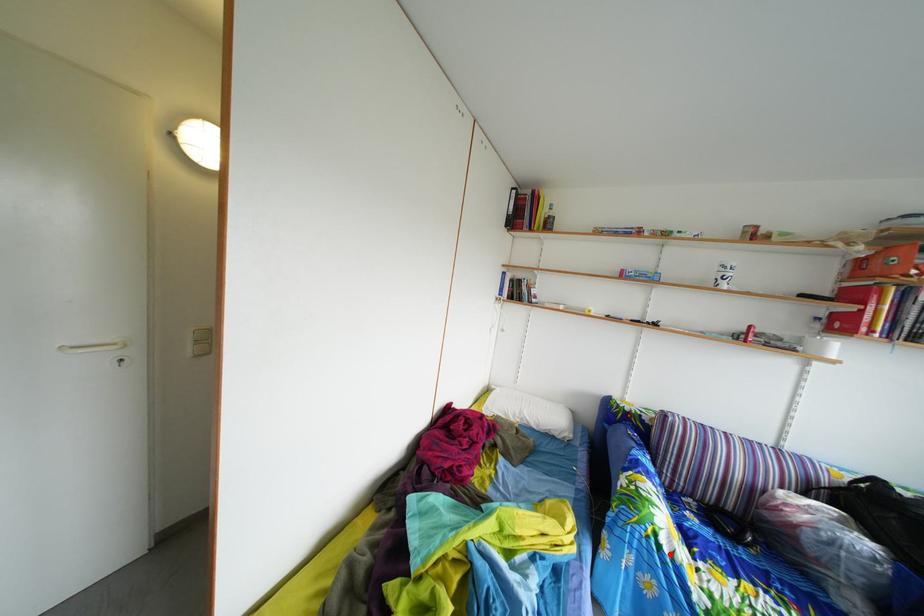
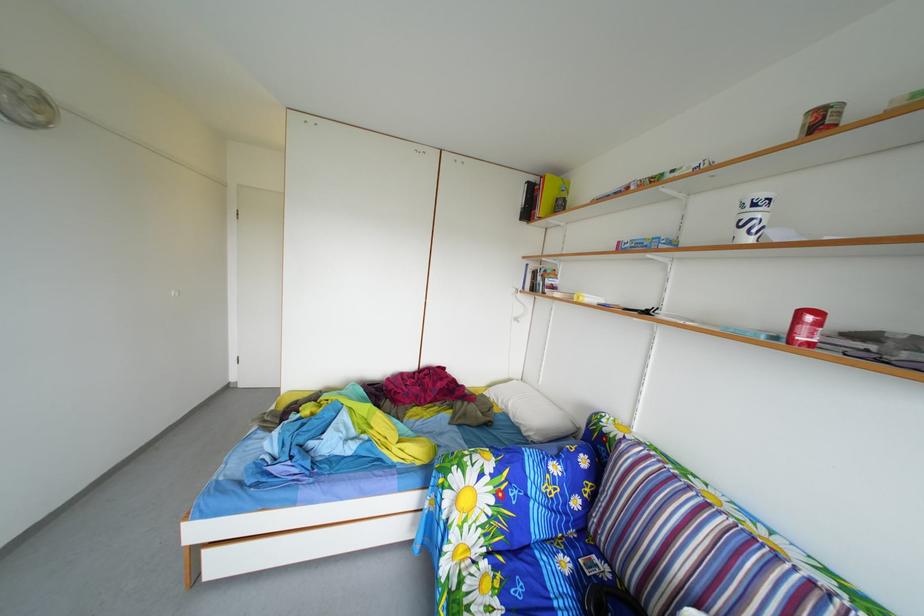
Question: I am providing you with two images of the same scene from different viewpoints. A red point is shown in image1. For the corresponding object point in image2, is it positioned nearer or farther from the camera?

Choices:
 (A) Nearer
 (B) Farther

Answer: (B)